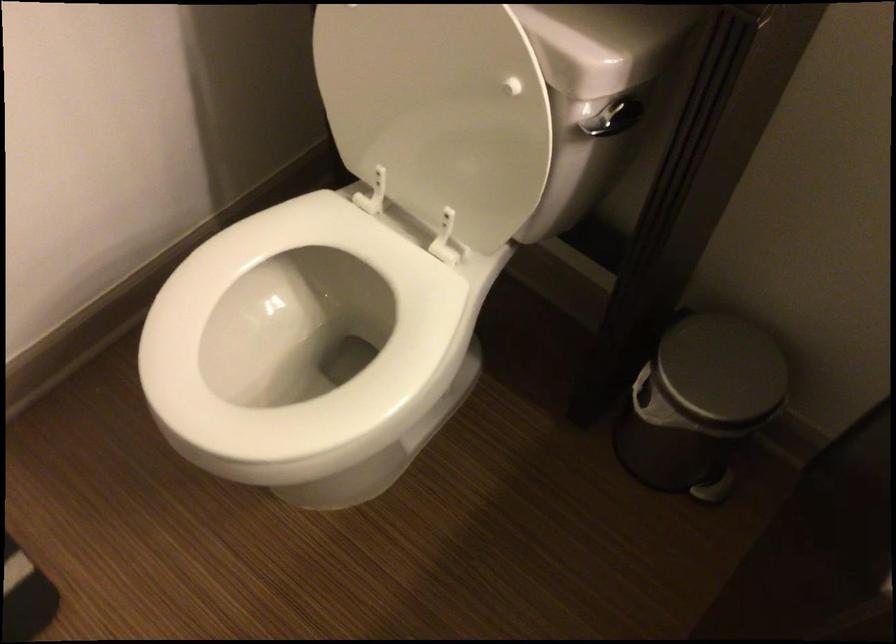
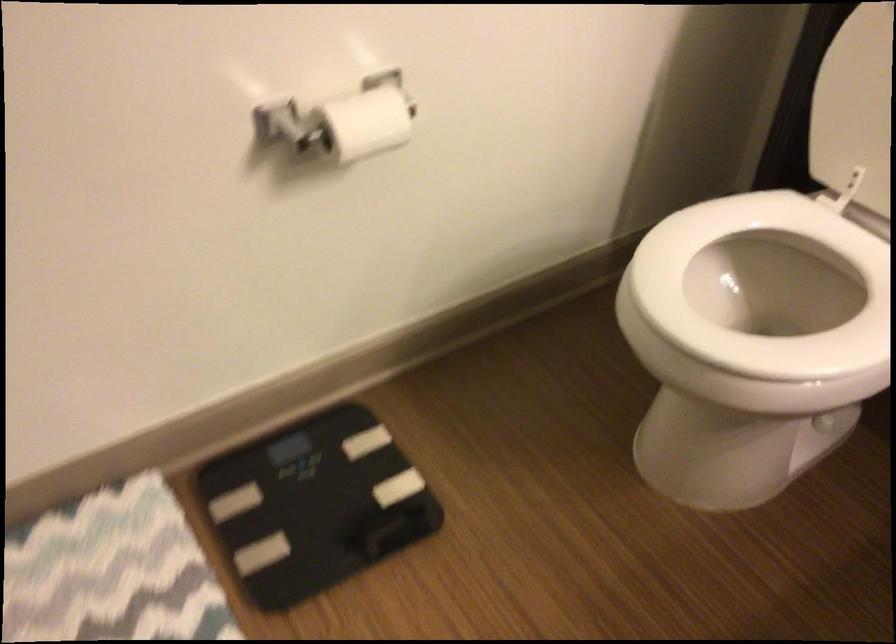
Question: The first image is from the beginning of the video and the second image is from the end. How did the camera likely rotate when shooting the video?

Choices:
 (A) Left
 (B) Right
 (C) Up
 (D) Down

Answer: (A)